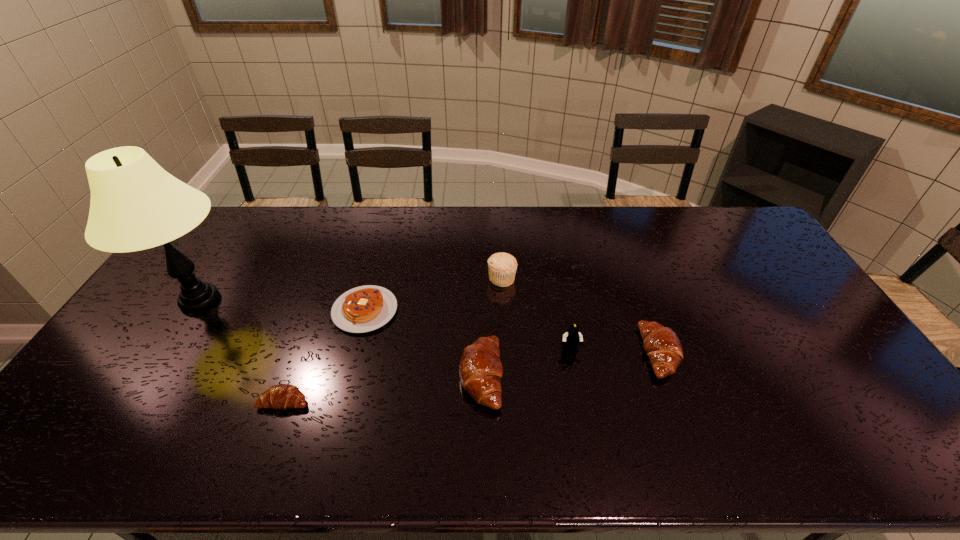
Find the location of a particular element. The width and height of the screenshot is (960, 540). free location that satisfies the following two spatial constraints: 1. on the front-facing side of the rightmost crescent roll; 2. on the left side of the Lego is located at coordinates (x=570, y=353).

This screenshot has width=960, height=540. Identify the location of vacant space that satisfies the following two spatial constraints: 1. on the back side of the rightmost object; 2. on the left side of the shortest crescent roll. (301, 353).